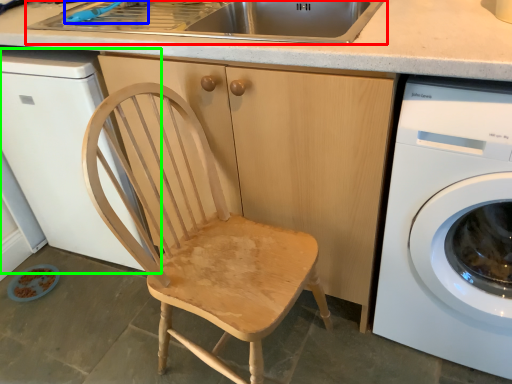
Question: Estimate the real-world distances between objects in this image. Which object is closer to sink (highlighted by a red box), faucet (highlighted by a blue box) or dish washer (highlighted by a green box)?

Choices:
 (A) faucet
 (B) dish washer

Answer: (A)